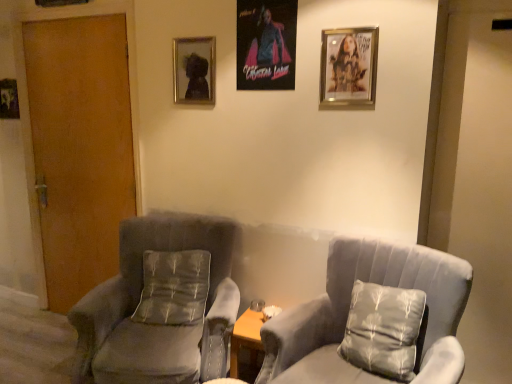
Measure the distance between point (9,94) and camera.

Point (9,94) is 2.84 meters away from camera.

Identify the location of satin gray pillow at right, which is counted as the first pillow, starting from the right. (383, 330).

Image resolution: width=512 pixels, height=384 pixels. What do you see at coordinates (174, 288) in the screenshot? I see `silky gray pillow at center, the 2th pillow in the right-to-left sequence` at bounding box center [174, 288].

At what (x,y) coordinates should I click in order to perform the action: click on silky gray pillow at center, the 2th pillow in the right-to-left sequence. Please return your answer as a coordinate pair (x, y). Looking at the image, I should click on (174, 288).

This screenshot has width=512, height=384. Describe the element at coordinates (348, 66) in the screenshot. I see `gold metallic picture frame at upper right, which ranks as the first picture frame in front-to-back order` at that location.

Measure the distance between point (x=286, y=38) and camera.

6.87 feet.

Where is `metallic silver picture frame at upper center, positioned as the 2th picture frame in back-to-front order`? metallic silver picture frame at upper center, positioned as the 2th picture frame in back-to-front order is located at coordinates (194, 70).

Image resolution: width=512 pixels, height=384 pixels. Identify the location of metallic silver picture frame at left, placed as the 1th picture frame when sorted from back to front. (9, 99).

From a real-world perspective, between silky gray pillow at center, the 2th pillow in the right-to-left sequence, and metallic poster at center, which ranks as the 2th picture frame in right-to-left order, who is vertically lower?

In real-world perspective, silky gray pillow at center, the 2th pillow in the right-to-left sequence, is lower.

Is silky gray pillow at center, which ranks as the 1th pillow in left-to-right order, completely or partially outside of metallic poster at center, which is the third picture frame from left to right?

Yes.

Is silky gray pillow at center, which ranks as the 1th pillow in left-to-right order, looking in the opposite direction of metallic poster at center, the 2th picture frame in the front-to-back sequence?

No, metallic poster at center, the 2th picture frame in the front-to-back sequence, is not at the back of silky gray pillow at center, which ranks as the 1th pillow in left-to-right order.

There is a metallic poster at center, which ranks as the 2th picture frame in right-to-left order. Where is `the 2nd pillow below it (from a real-world perspective)`? the 2nd pillow below it (from a real-world perspective) is located at coordinates (174, 288).

Is the position of metallic silver picture frame at upper center, the third picture frame when ordered from front to back, more distant than that of suede gray chair at center, arranged as the 2th chair when viewed from the left?

Yes, it is.

Between point (181, 91) and point (380, 265), which one is positioned behind?

Positioned behind is point (181, 91).

Considering the relative sizes of metallic silver picture frame at upper center, the third picture frame when ordered from front to back, and suede gray chair at center, arranged as the 2th chair when viewed from the left, in the image provided, is metallic silver picture frame at upper center, the third picture frame when ordered from front to back, thinner than suede gray chair at center, arranged as the 2th chair when viewed from the left,?

Correct, the width of metallic silver picture frame at upper center, the third picture frame when ordered from front to back, is less than that of suede gray chair at center, arranged as the 2th chair when viewed from the left.

Which object is further away from the camera, metallic poster at center, the 3th picture frame when ordered from back to front, or suede gray chair at center, arranged as the 2th chair when viewed from the left?

metallic poster at center, the 3th picture frame when ordered from back to front, is more distant.

From a real-world perspective, is metallic poster at center, the 2th picture frame in the front-to-back sequence, positioned under suede gray chair at center, acting as the 1th chair starting from the right, based on gravity?

No, from a real-world perspective, metallic poster at center, the 2th picture frame in the front-to-back sequence, is not beneath suede gray chair at center, acting as the 1th chair starting from the right.

From the picture: Does metallic poster at center, the 2th picture frame in the front-to-back sequence, contain suede gray chair at center, acting as the 1th chair starting from the right?

That's incorrect, suede gray chair at center, acting as the 1th chair starting from the right, is not inside metallic poster at center, the 2th picture frame in the front-to-back sequence.

Considering the relative sizes of metallic poster at center, which is the third picture frame from left to right, and suede gray chair at center, acting as the 1th chair starting from the right, in the image provided, is metallic poster at center, which is the third picture frame from left to right, shorter than suede gray chair at center, acting as the 1th chair starting from the right,?

Yes.

Is metallic silver picture frame at upper center, the third picture frame when ordered from front to back, at the right side of metallic poster at center, the 3th picture frame when ordered from back to front?

No.

Who is bigger, metallic silver picture frame at upper center, arranged as the 3th picture frame when viewed from the right, or metallic poster at center, the 3th picture frame when ordered from back to front?

metallic silver picture frame at upper center, arranged as the 3th picture frame when viewed from the right.

Which of these two, metallic silver picture frame at upper center, positioned as the 2th picture frame in back-to-front order, or metallic poster at center, which ranks as the 2th picture frame in right-to-left order, stands taller?

metallic poster at center, which ranks as the 2th picture frame in right-to-left order.

Which is closer, (314, 362) or (352, 42)?

Point (314, 362) appears to be closer to the viewer than point (352, 42).

Is the position of suede gray chair at center, acting as the 1th chair starting from the right, less distant than that of gold metallic picture frame at upper right, which ranks as the first picture frame in front-to-back order?

Yes, it is in front of gold metallic picture frame at upper right, which ranks as the first picture frame in front-to-back order.

From the picture: Which object is wider, suede gray chair at center, acting as the 1th chair starting from the right, or gold metallic picture frame at upper right, which ranks as the first picture frame in front-to-back order?

suede gray chair at center, acting as the 1th chair starting from the right, is wider.

Considering the sizes of objects metallic silver picture frame at upper center, positioned as the 2th picture frame in back-to-front order, and velvet gray armchair at left, which is the second chair from right to left, in the image provided, who is thinner, metallic silver picture frame at upper center, positioned as the 2th picture frame in back-to-front order, or velvet gray armchair at left, which is the second chair from right to left,?

Thinner between the two is metallic silver picture frame at upper center, positioned as the 2th picture frame in back-to-front order.

Is the surface of metallic silver picture frame at upper center, positioned as the 2th picture frame in back-to-front order, in direct contact with velvet gray armchair at left, which is the second chair from right to left?

They are not placed beside each other.

Is metallic silver picture frame at upper center, the third picture frame when ordered from front to back, bigger than velvet gray armchair at left, the first chair viewed from the left?

No.

Between metallic silver picture frame at upper center, which appears as the second picture frame when viewed from the left, and velvet gray armchair at left, the first chair viewed from the left, which one appears on the left side from the viewer's perspective?

From the viewer's perspective, velvet gray armchair at left, the first chair viewed from the left, appears more on the left side.

Considering the positions of objects satin gray pillow at right, which is the 2th pillow from left to right, and metallic silver picture frame at left, the 4th picture frame in the front-to-back sequence, in the image provided, who is more to the right, satin gray pillow at right, which is the 2th pillow from left to right, or metallic silver picture frame at left, the 4th picture frame in the front-to-back sequence,?

From the viewer's perspective, satin gray pillow at right, which is the 2th pillow from left to right, appears more on the right side.

Is point (367, 300) closer or farther from the camera than point (0, 87)?

Point (367, 300) is closer to the camera than point (0, 87).

Does satin gray pillow at right, the 1th pillow viewed from the front, lie in front of metallic silver picture frame at left, which appears as the first picture frame when viewed from the left?

Yes.

From a real-world perspective, who is located higher, satin gray pillow at right, the 1th pillow viewed from the front, or metallic silver picture frame at left, which appears as the first picture frame when viewed from the left?

metallic silver picture frame at left, which appears as the first picture frame when viewed from the left.

This screenshot has width=512, height=384. Find the location of `the 1st picture frame in front of the silky gray pillow at center, acting as the second pillow starting from the front, counting from the anchor's position`. the 1st picture frame in front of the silky gray pillow at center, acting as the second pillow starting from the front, counting from the anchor's position is located at coordinates (266, 44).

Identify the location of chair that is the 2nd one when counting downward from the metallic silver picture frame at upper center, the third picture frame when ordered from front to back (from the image's perspective). This screenshot has width=512, height=384. (349, 309).

Considering their positions, is wooden door at left positioned closer to gold metallic picture frame at upper right, acting as the fourth picture frame starting from the left, than velvet gray armchair at left, which is the second chair from right to left?

Based on the image, velvet gray armchair at left, which is the second chair from right to left, appears to be nearer to gold metallic picture frame at upper right, acting as the fourth picture frame starting from the left.

Based on their spatial positions, is silky gray pillow at center, which is the 1th pillow in back-to-front order, or wooden door at left further from metallic poster at center, which ranks as the 2th picture frame in right-to-left order?

Among the two, silky gray pillow at center, which is the 1th pillow in back-to-front order, is located further to metallic poster at center, which ranks as the 2th picture frame in right-to-left order.

Which object lies nearer to the anchor point satin gray pillow at right, the 1th pillow viewed from the front, metallic silver picture frame at left, the 4th picture frame in the front-to-back sequence, or metallic silver picture frame at upper center, which appears as the second picture frame when viewed from the left?

The object closer to satin gray pillow at right, the 1th pillow viewed from the front, is metallic silver picture frame at upper center, which appears as the second picture frame when viewed from the left.

Looking at the image, which one is located closer to gold metallic picture frame at upper right, which ranks as the first picture frame in front-to-back order, suede gray chair at center, arranged as the 2th chair when viewed from the left, or metallic poster at center, which ranks as the 2th picture frame in right-to-left order?

Based on the image, metallic poster at center, which ranks as the 2th picture frame in right-to-left order, appears to be nearer to gold metallic picture frame at upper right, which ranks as the first picture frame in front-to-back order.

From the picture: Based on their spatial positions, is gold metallic picture frame at upper right, acting as the fourth picture frame starting from the left, or metallic poster at center, which is the third picture frame from left to right, closer to metallic silver picture frame at left, placed as the 1th picture frame when sorted from back to front?

Based on the image, metallic poster at center, which is the third picture frame from left to right, appears to be nearer to metallic silver picture frame at left, placed as the 1th picture frame when sorted from back to front.

Estimate the real-world distances between objects in this image. Which object is further from velvet gray armchair at left, which is the second chair from right to left, satin gray pillow at right, the 1th pillow viewed from the front, or gold metallic picture frame at upper right, which ranks as the first picture frame in front-to-back order?

Among the two, gold metallic picture frame at upper right, which ranks as the first picture frame in front-to-back order, is located further to velvet gray armchair at left, which is the second chair from right to left.

Estimate the real-world distances between objects in this image. Which object is further from wooden door at left, metallic poster at center, the 3th picture frame when ordered from back to front, or silky gray pillow at center, which ranks as the 1th pillow in left-to-right order?

Based on the image, metallic poster at center, the 3th picture frame when ordered from back to front, appears to be further to wooden door at left.

Based on their spatial positions, is satin gray pillow at right, which is the 2th pillow from left to right, or gold metallic picture frame at upper right, which ranks as the first picture frame in front-to-back order, further from metallic silver picture frame at left, the fourth picture frame when ordered from right to left?

satin gray pillow at right, which is the 2th pillow from left to right, is positioned further to the anchor metallic silver picture frame at left, the fourth picture frame when ordered from right to left.

The width and height of the screenshot is (512, 384). I want to click on door between metallic poster at center, the 3th picture frame when ordered from back to front, and silky gray pillow at center, the 2th pillow in the right-to-left sequence, vertically, so click(x=80, y=148).

In order to click on pillow between wooden door at left and suede gray chair at center, acting as the 1th chair starting from the right, from left to right in this screenshot , I will do `click(174, 288)`.

I want to click on pillow located between velvet gray armchair at left, the first chair viewed from the left, and satin gray pillow at right, which is the 2th pillow from left to right, in the left-right direction, so click(x=174, y=288).

What are the coordinates of `door between metallic poster at center, which ranks as the 2th picture frame in right-to-left order, and velvet gray armchair at left, which is the second chair from right to left, from top to bottom` in the screenshot? It's located at (80, 148).